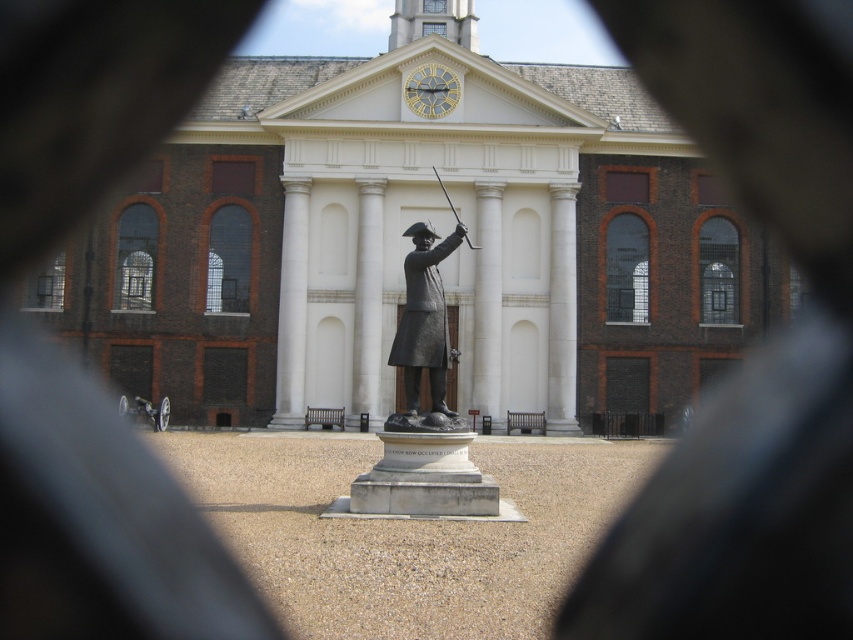
Between point (549, 426) and point (436, 317), which one is positioned behind?

The point (549, 426) is behind.

Who is shorter, white stone church at center or bronze statue at center?

With less height is bronze statue at center.

Is point (457, 116) behind point (410, 326)?

That is True.

Locate an element on the screen. white stone church at center is located at coordinates (407, 243).

Is bronze statue at center in front of gold/yellow metal clock at upper center?

That is True.

At what (x,y) coordinates should I click in order to perform the action: click on bronze statue at center. Please return your answer as a coordinate pair (x, y). This screenshot has height=640, width=853. Looking at the image, I should click on (424, 320).

Can you confirm if white stone church at center is positioned to the right of gold/yellow metal clock at upper center?

Incorrect, white stone church at center is not on the right side of gold/yellow metal clock at upper center.

Image resolution: width=853 pixels, height=640 pixels. What do you see at coordinates (407, 243) in the screenshot?
I see `white stone church at center` at bounding box center [407, 243].

Which is behind, point (289, 248) or point (434, 90)?

The point (434, 90) is more distant.

Locate an element on the screen. white stone church at center is located at coordinates (407, 243).